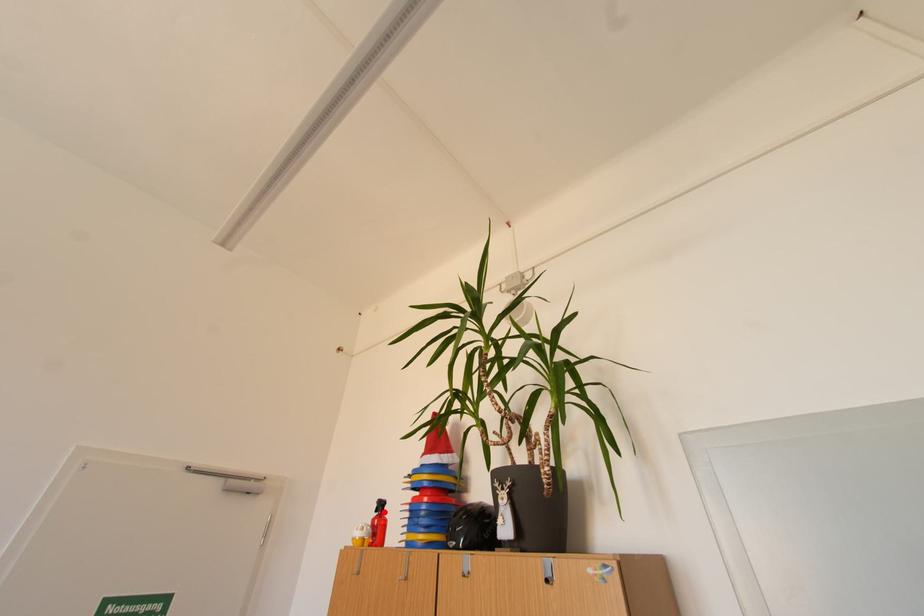
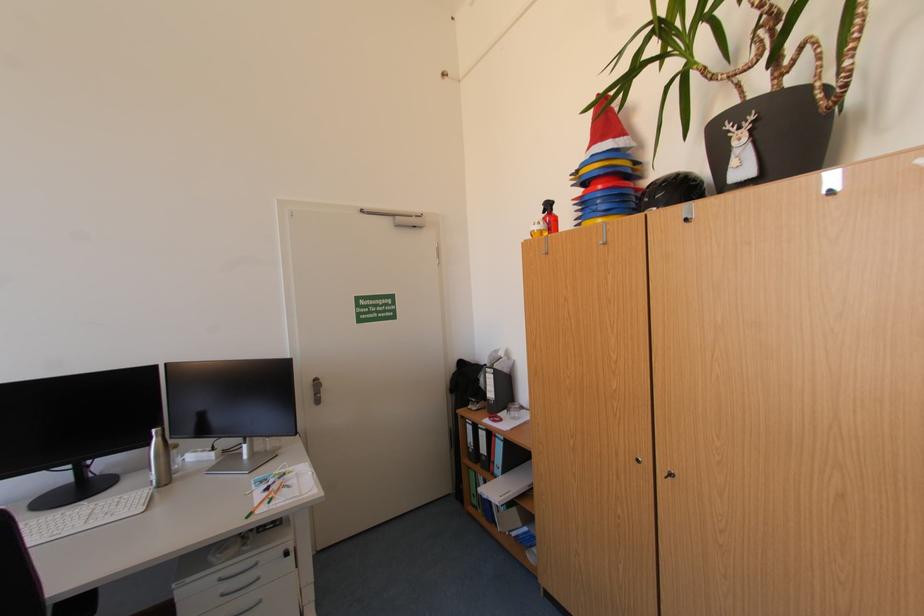
The point at the highlighted location is marked in the first image. Where is the corresponding point in the second image?

(552, 213)